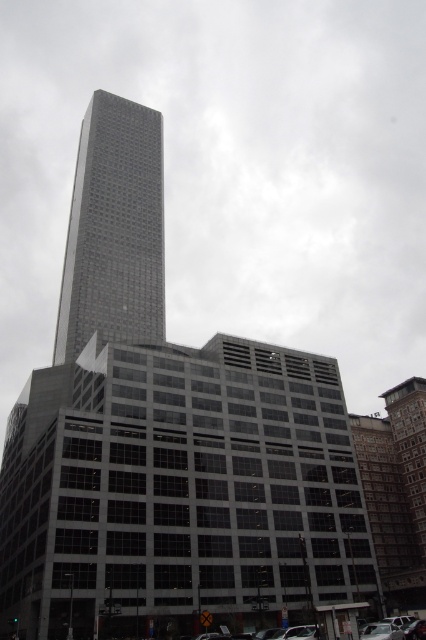
You are standing in the urban landscape and want to determine which of the two points, point [120,244] or point [388,625], is closer to you. Which one is closer?

Point [120,244] is closer to you because it is further to the viewer than point [388,625].

You are standing at the intersection and see the gray glass skyscraper at center and the metallic silver car at lower right. Which object is positioned more to the east if the sun is setting in the west?

The gray glass skyscraper at center is to the left of metallic silver car at lower right. Since the sun is setting in the west, the metallic silver car at lower right is positioned more to the east because it is to the right of the skyscraper, which would be facing westward.

You are standing at the edge of the street looking towards the gray glass skyscraper at center and the metallic silver car at lower right. Which object is wider from your perspective?

The gray glass skyscraper at center is wider than the metallic silver car at lower right according to the description provided.